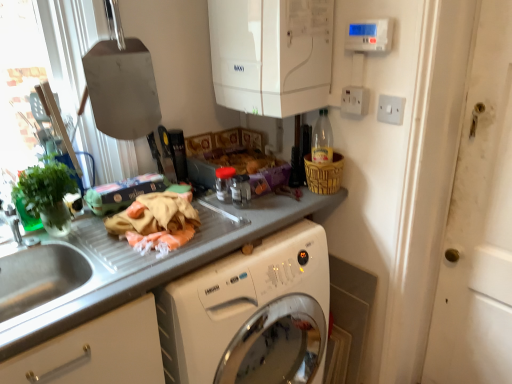
Where is `free location above smooth gray countertop at center (from a real-world perspective)`? The height and width of the screenshot is (384, 512). free location above smooth gray countertop at center (from a real-world perspective) is located at coordinates (158, 241).